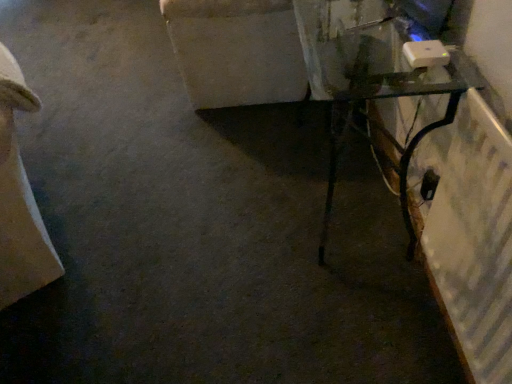
Question: Considering their positions, is blue glossy monitor at upper right located in front of or behind transparent glass table at right?

Choices:
 (A) behind
 (B) front

Answer: (A)

Question: Considering the positions of point (437, 8) and point (444, 57), is point (437, 8) closer or farther from the camera than point (444, 57)?

Choices:
 (A) closer
 (B) farther

Answer: (B)

Question: Which of these objects is positioned closest to the beige fabric couch at left?

Choices:
 (A) blue glossy monitor at upper right
 (B) transparent glass table at right

Answer: (B)

Question: Estimate the real-world distances between objects in this image. Which object is closer to the beige fabric couch at left?

Choices:
 (A) transparent glass table at right
 (B) blue glossy monitor at upper right

Answer: (A)